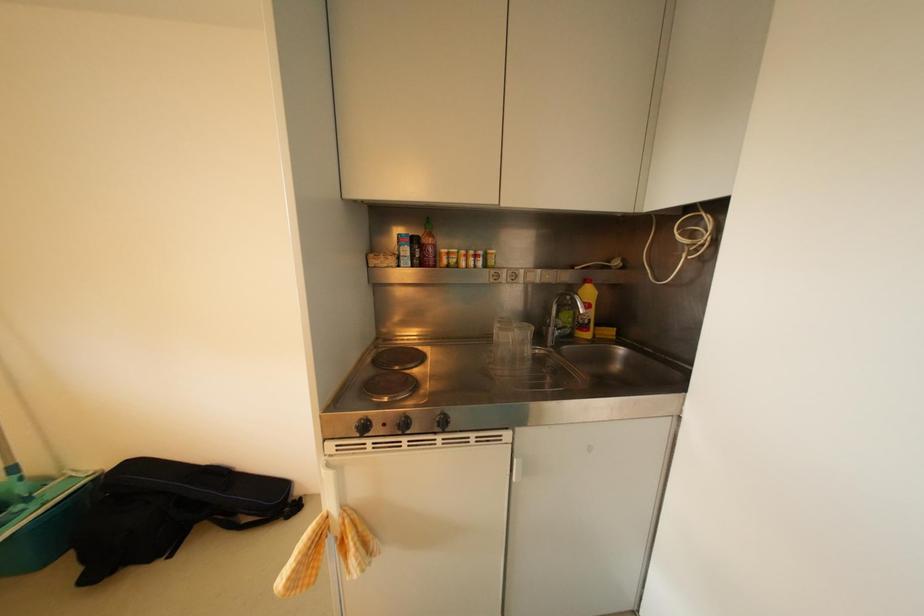
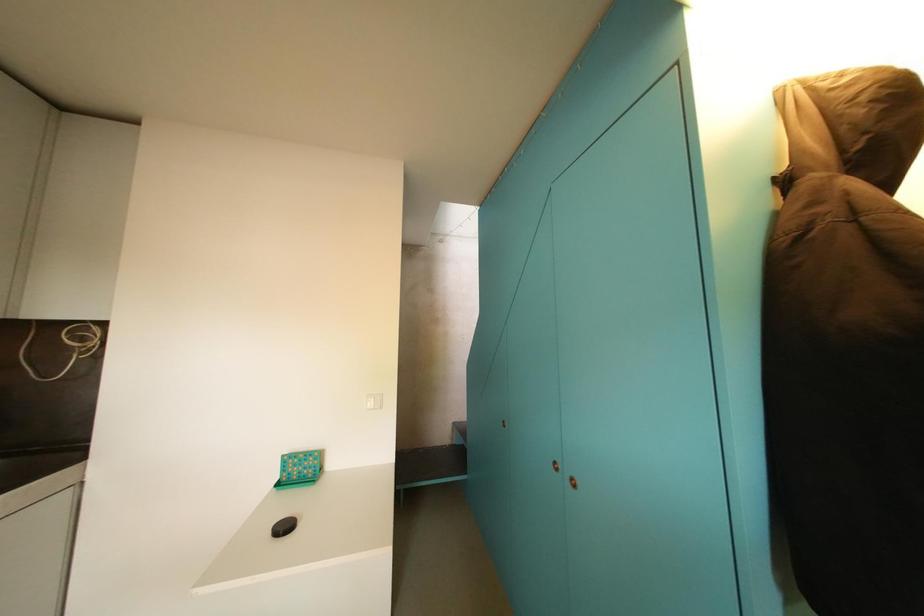
Question: The camera is either moving clockwise (left) or counter-clockwise (right) around the object. The first image is from the beginning of the video and the second image is from the end. Is the camera moving left or right when shooting the video?

Choices:
 (A) Left
 (B) Right

Answer: (A)